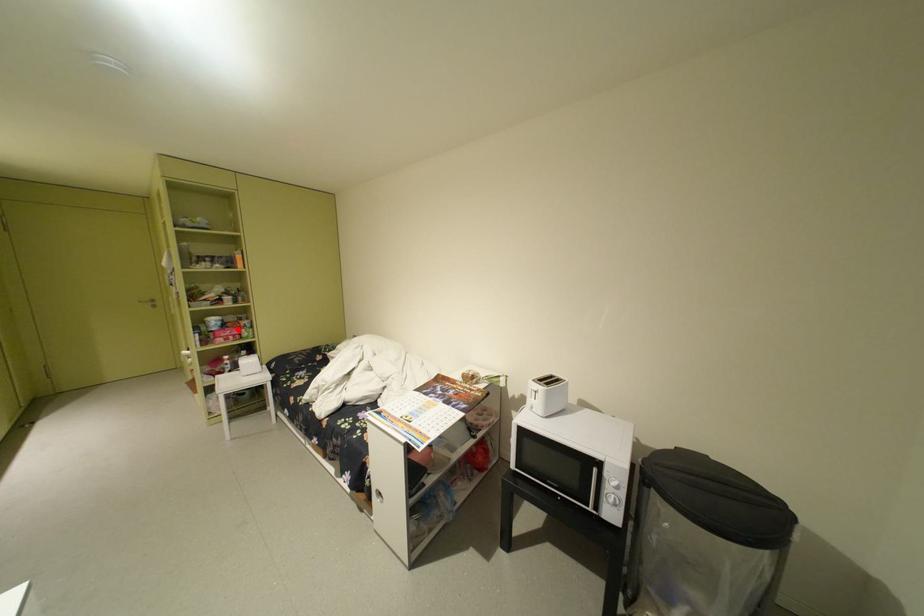
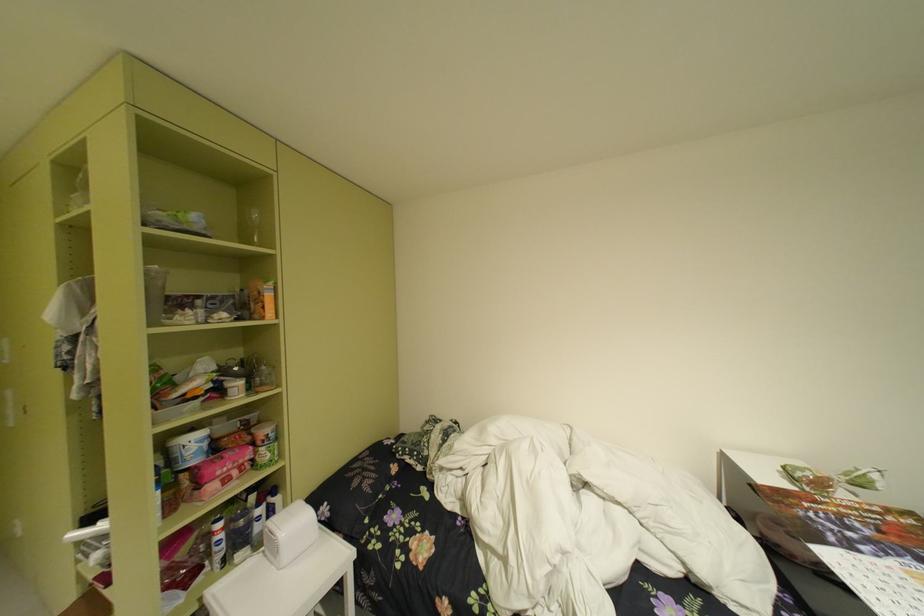
The point at the highlighted location is marked in the first image. Where is the corresponding point in the second image?

(238, 455)